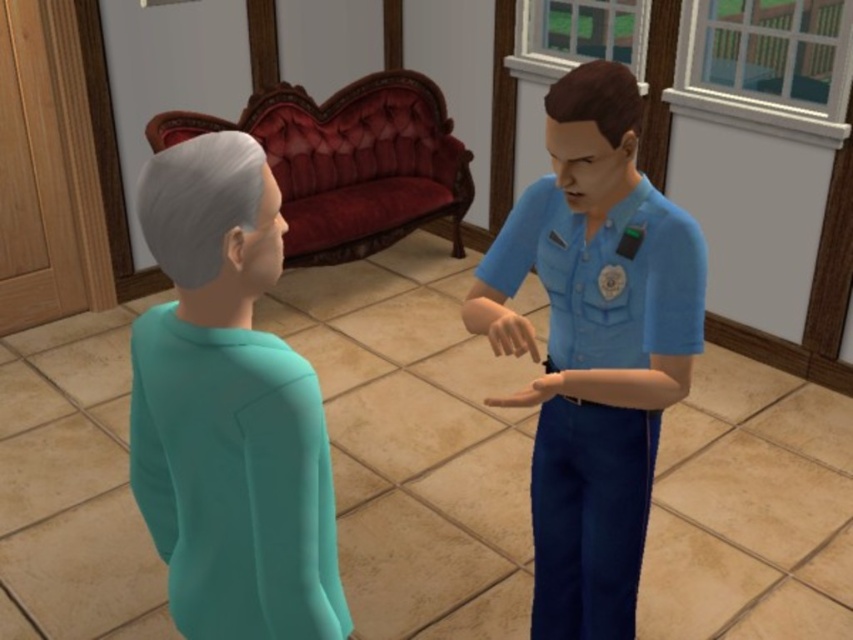
You are standing at the center of the room and want to walk towards the blue fabric uniform at right. Which direction should you go?

Since the blue fabric uniform at right is positioned at point 0.608 on the x and 0.702 on the y coordinate, you should move towards the right and slightly forward to reach it.

You are standing in the room and want to hand a document to both the blue fabric uniform at right and the teal matte sweater at lower left. Which person should you approach first to ensure you can reach them without moving around furniture?

You should approach the blue fabric uniform at right first because it is closer to you than the teal matte sweater at lower left, which is further away.